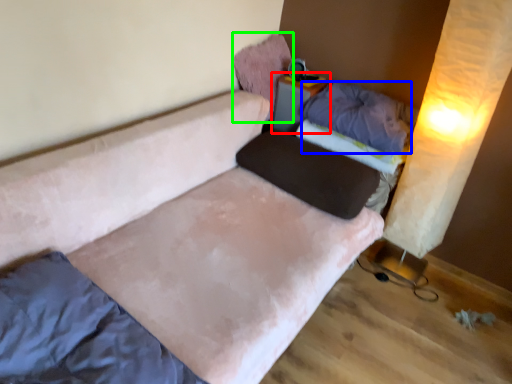
Question: Which object is positioned farthest from table (highlighted by a red box)? Select from pillow (highlighted by a blue box) and pillow (highlighted by a green box).

Choices:
 (A) pillow
 (B) pillow

Answer: (A)